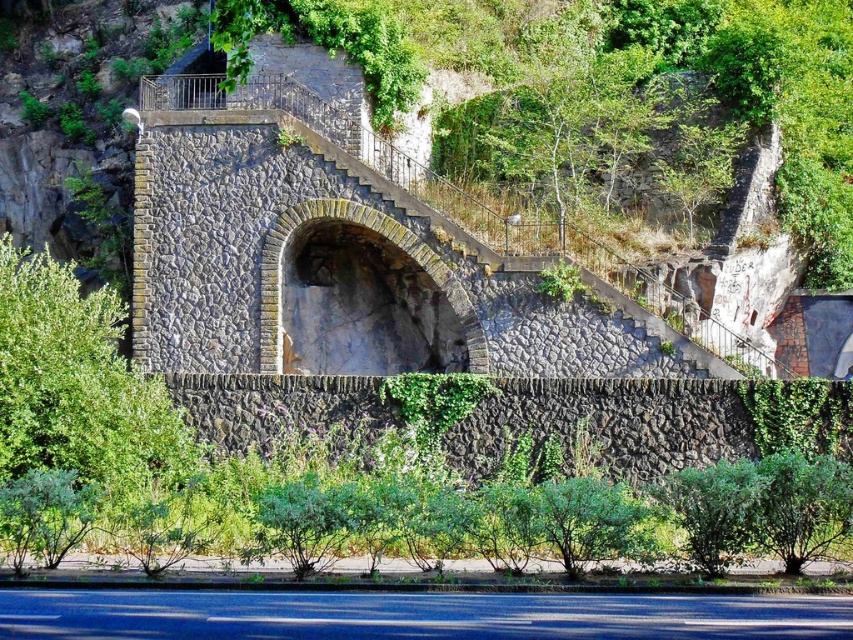
In the scene shown: Which of these two, green leafy bush at lower left or green leafy bush at lower right, stands taller?

With more height is green leafy bush at lower left.

Consider the image. Does green leafy bush at lower left have a lesser width compared to green leafy bush at lower right?

No, green leafy bush at lower left is not thinner than green leafy bush at lower right.

From the picture: Who is more distant from viewer, (9, 352) or (781, 468)?

The point (9, 352) is behind.

Find the location of `green leafy bush at lower left`. green leafy bush at lower left is located at coordinates (79, 387).